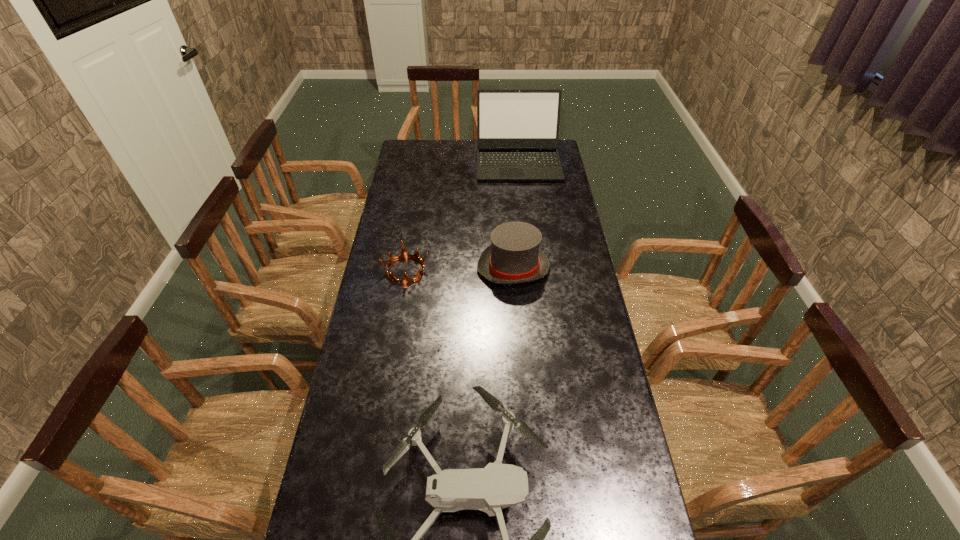
Find the location of a particular element. The image size is (960, 540). dress hat present at the right edge is located at coordinates (514, 256).

Locate an element on the screen. object situated at the far right corner is located at coordinates (517, 130).

Identify the location of vacant region at the left edge of the desktop. The image size is (960, 540). (351, 539).

Where is `free space at the right edge of the desktop`? The width and height of the screenshot is (960, 540). free space at the right edge of the desktop is located at coordinates (571, 299).

Where is `free space at the far left corner`? The image size is (960, 540). free space at the far left corner is located at coordinates (430, 151).

You are a GUI agent. You are given a task and a screenshot of the screen. Output one action in this format:
    pyautogui.click(x=<x>, y=<y>)
    Task: Click on the free spot between the crown and the laptop
    The width and height of the screenshot is (960, 540).
    Given the screenshot: What is the action you would take?
    pyautogui.click(x=462, y=215)

You are a GUI agent. You are given a task and a screenshot of the screen. Output one action in this format:
    pyautogui.click(x=<x>, y=<y>)
    Task: Click on the unoccupied area between the second tallest object and the laptop
    
    Given the screenshot: What is the action you would take?
    pyautogui.click(x=516, y=214)

I want to click on free space between the dress hat and the laptop, so click(x=516, y=214).

What are the coordinates of `free space that is in between the second tallest object and the shortest object` in the screenshot? It's located at (460, 269).

Where is `free space between the third shortest object and the laptop`? Image resolution: width=960 pixels, height=540 pixels. free space between the third shortest object and the laptop is located at coordinates (516, 214).